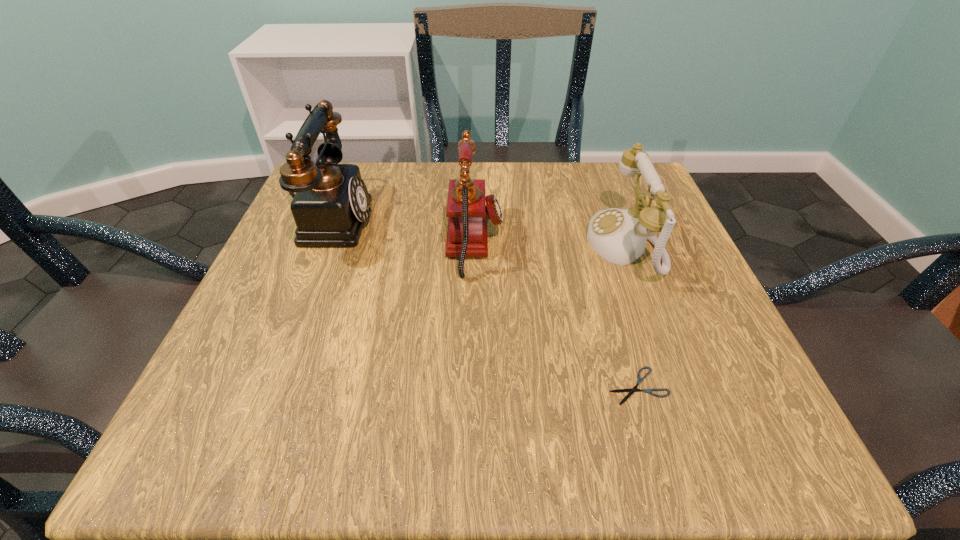
This screenshot has width=960, height=540. What are the coordinates of `free space that satisfies the following two spatial constraints: 1. on the dial of the shears; 2. on the right side of the second object from left to right` in the screenshot? It's located at (473, 386).

Where is `free space that satisfies the following two spatial constraints: 1. on the dial of the rightmost telephone; 2. on the front side of the nearest object`? Image resolution: width=960 pixels, height=540 pixels. free space that satisfies the following two spatial constraints: 1. on the dial of the rightmost telephone; 2. on the front side of the nearest object is located at coordinates (676, 386).

The image size is (960, 540). I want to click on free spot that satisfies the following two spatial constraints: 1. on the front of the shears at the rotary dial; 2. on the left side of the leftmost object, so pyautogui.click(x=261, y=386).